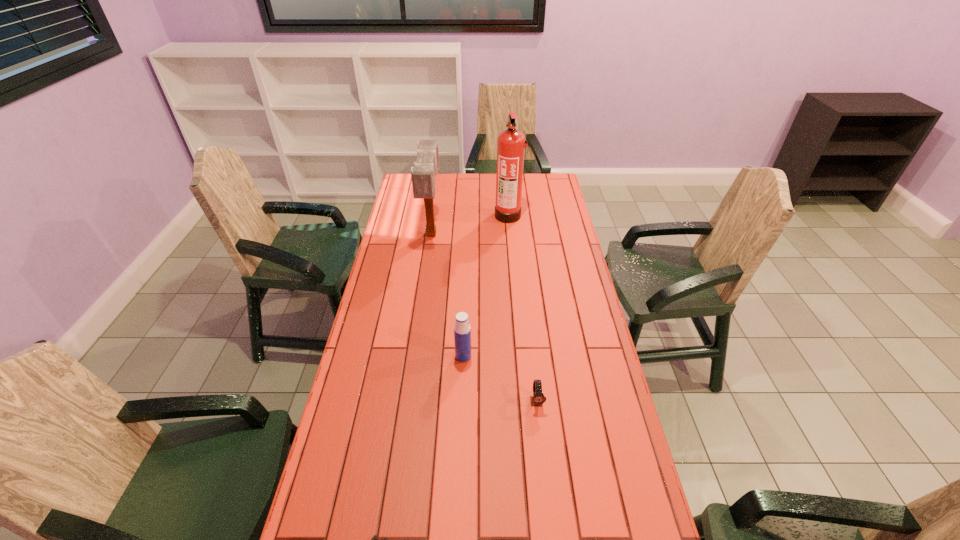
What are the coordinates of `vacant space located 0.130m on the left of the third object from left to right` in the screenshot? It's located at (416, 356).

At what (x,y) coordinates should I click in order to perform the action: click on free space located on the face of the second shortest object. Please return your answer as a coordinate pair (x, y). Image resolution: width=960 pixels, height=540 pixels. Looking at the image, I should click on (542, 455).

The width and height of the screenshot is (960, 540). What are the coordinates of `object located in the left edge section of the desktop` in the screenshot? It's located at (423, 173).

This screenshot has height=540, width=960. What are the coordinates of `vacant space at the far edge of the desktop` in the screenshot? It's located at (436, 178).

Image resolution: width=960 pixels, height=540 pixels. Find the location of `vacant space at the left edge of the desktop`. vacant space at the left edge of the desktop is located at coordinates (417, 273).

Where is `free space at the right edge of the desktop`? This screenshot has width=960, height=540. free space at the right edge of the desktop is located at coordinates (649, 517).

The image size is (960, 540). What are the coordinates of `vacant area at the far right corner` in the screenshot? It's located at (542, 192).

At what (x,y) coordinates should I click in order to perform the action: click on free space between the second tallest object and the third object from right to left. Please return your answer as a coordinate pair (x, y). Image resolution: width=960 pixels, height=540 pixels. Looking at the image, I should click on (447, 295).

The height and width of the screenshot is (540, 960). Identify the location of vacant area that lies between the third nearest object and the tallest object. (486, 286).

Where is `unoccupied area between the tallest object and the mallet`? The width and height of the screenshot is (960, 540). unoccupied area between the tallest object and the mallet is located at coordinates (470, 225).